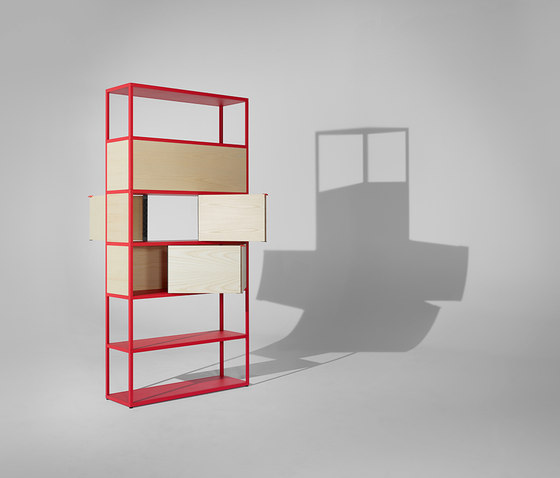
The width and height of the screenshot is (560, 478). I want to click on shadow of shelves, so click(x=348, y=282).